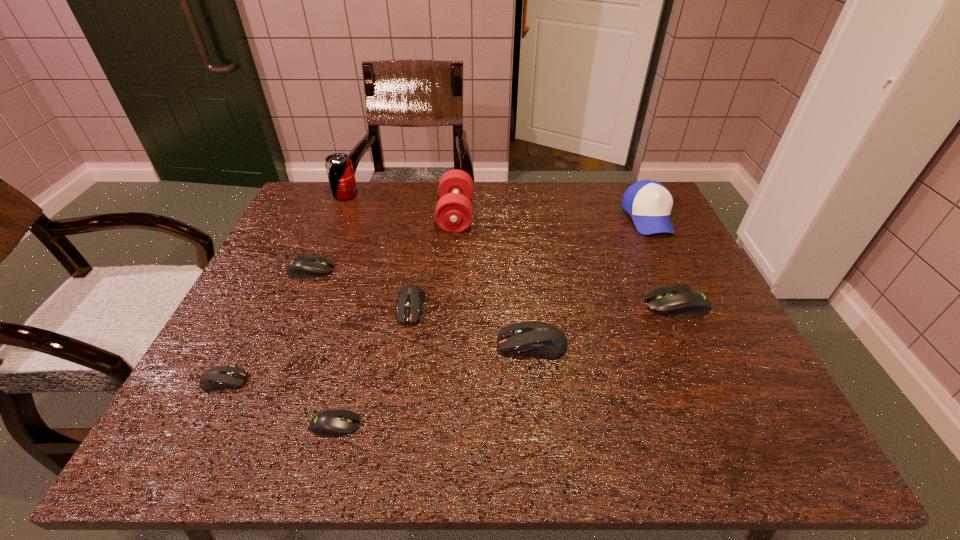
Locate an element on the screen. vacant region between the biggest gray computer mouse and the baseball cap is located at coordinates (662, 261).

Identify the location of free area in between the second dark computer equipment from left to right and the biggest gray computer mouse. The width and height of the screenshot is (960, 540). (543, 306).

The image size is (960, 540). Identify the location of free space between the seventh object from left to right and the second farthest gray computer mouse. (604, 325).

Where is `object that is the sixth closest one to the leftmost dark computer equipment`? Image resolution: width=960 pixels, height=540 pixels. object that is the sixth closest one to the leftmost dark computer equipment is located at coordinates (339, 168).

Identify which object is the eighth nearest to the baseball cap. Please provide its 2D coordinates. Your answer should be formatted as a tuple, i.e. [(x, y)], where the tuple contains the x and y coordinates of a point satisfying the conditions above.

[(223, 377)]

Find the location of a particular element. The width and height of the screenshot is (960, 540). the closest computer mouse to the white baseball cap is located at coordinates (684, 301).

Locate which computer mouse is the second closest to the rightmost gray computer mouse. Please provide its 2D coordinates. Your answer should be formatted as a tuple, i.e. [(x, y)], where the tuple contains the x and y coordinates of a point satisfying the conditions above.

[(410, 299)]

Point out which dark computer equipment is positioned as the third nearest to the tallest object. Please provide its 2D coordinates. Your answer should be formatted as a tuple, i.e. [(x, y)], where the tuple contains the x and y coordinates of a point satisfying the conditions above.

[(538, 339)]

The image size is (960, 540). I want to click on dark computer equipment that is the second nearest to the second nearest dark computer equipment, so click(x=223, y=377).

Select which gray computer mouse appears as the closest to the sixth object from right to left. Please provide its 2D coordinates. Your answer should be formatted as a tuple, i.e. [(x, y)], where the tuple contains the x and y coordinates of a point satisfying the conditions above.

[(306, 266)]